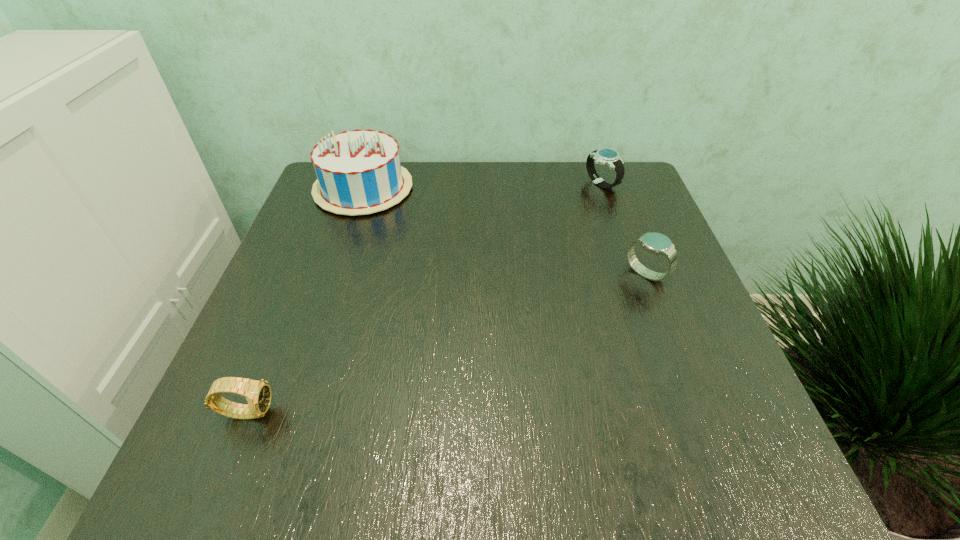
I want to click on the tallest object, so click(359, 172).

The image size is (960, 540). What are the coordinates of `the farthest watch` in the screenshot? It's located at (606, 156).

This screenshot has height=540, width=960. I want to click on the second nearest object, so click(x=656, y=243).

At what (x,y) coordinates should I click in order to perform the action: click on the nearest watch. Please return your answer as a coordinate pair (x, y). This screenshot has height=540, width=960. Looking at the image, I should click on (258, 394).

Locate an element on the screen. The image size is (960, 540). the nearest object is located at coordinates (258, 394).

This screenshot has height=540, width=960. In order to click on vacant space located on the right of the tallest object in this screenshot , I will do `click(547, 188)`.

The width and height of the screenshot is (960, 540). In order to click on vacant space located 0.290m on the left of the farthest watch in this screenshot , I will do `click(475, 184)`.

Image resolution: width=960 pixels, height=540 pixels. Find the location of `free space located on the left of the second farthest watch`. free space located on the left of the second farthest watch is located at coordinates (587, 274).

Identify the location of vacant space located 0.320m on the face of the nearest object. (475, 411).

Find the location of `birthday cake located in the far edge section of the desktop`. birthday cake located in the far edge section of the desktop is located at coordinates (359, 172).